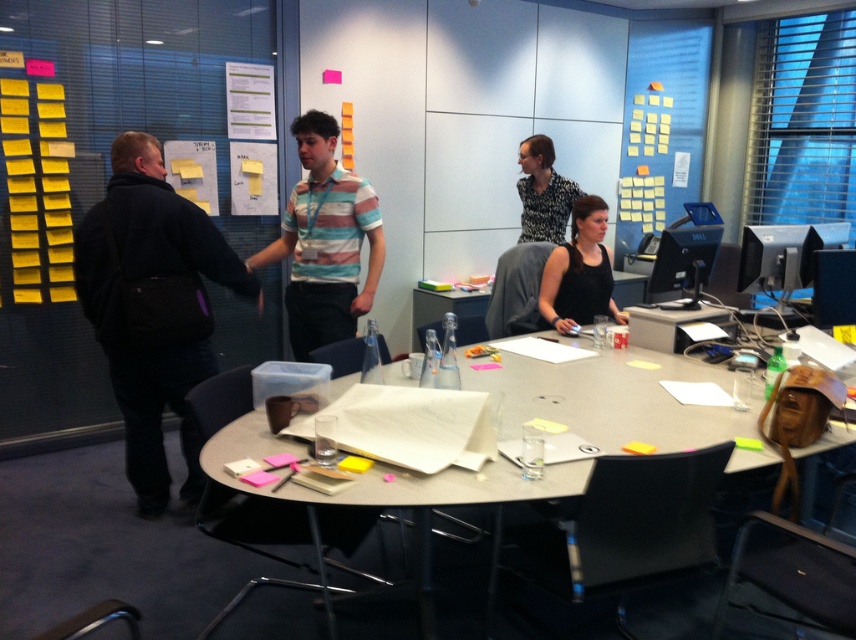
In the office scene, there are two people wearing different clothing items. The dark gray jacket at left and the printed fabric blouse at center. Which clothing item is larger in size?

The dark gray jacket at left is bigger than the printed fabric blouse at center.

You are attending a meeting in the office and need to locate the striped cotton shirt at center. From your perspective, which side of the matte gray table at center should you look towards to find it?

The striped cotton shirt at center is to the left of the matte gray table at center, so you should look to the left side of the matte gray table at center to find it.

Looking at this image, you are standing in the modern office scene described. You need to place a new decorative item on the matte gray table at center. Where exactly should you place it?

The matte gray table at center is located at coordinates point (613, 400), so you should place the decorative item there.